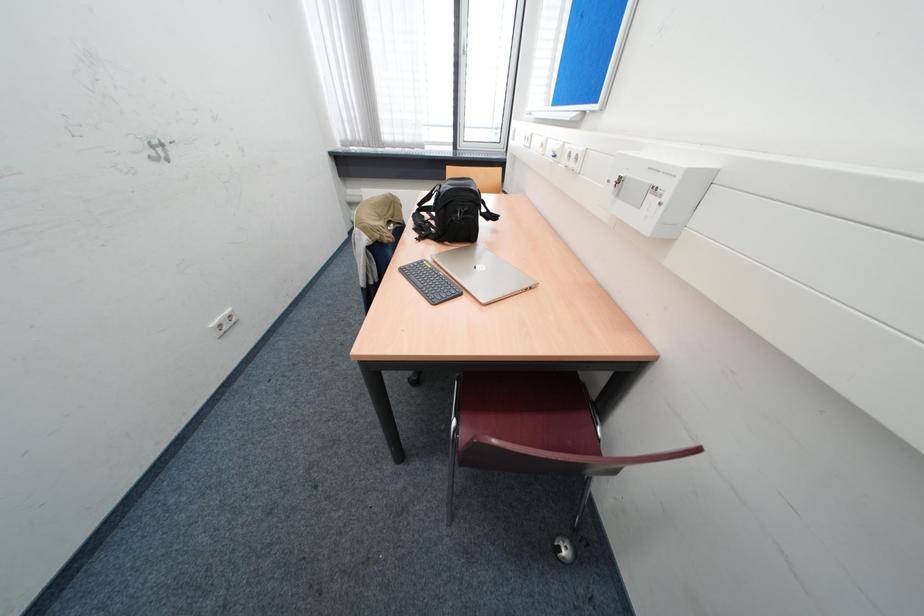
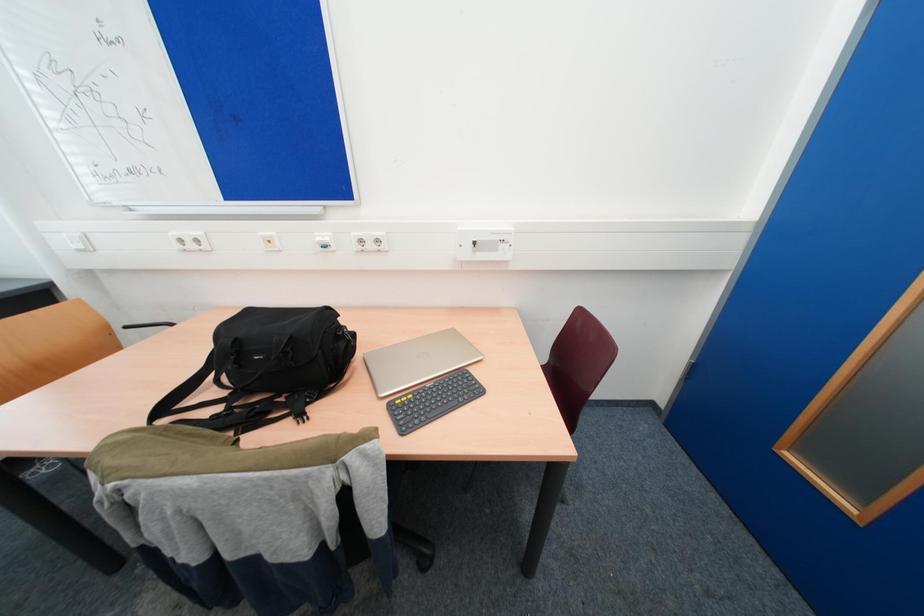
First-person continuous shooting, in which direction is the camera rotating?

The rotation direction of the camera is right-down.